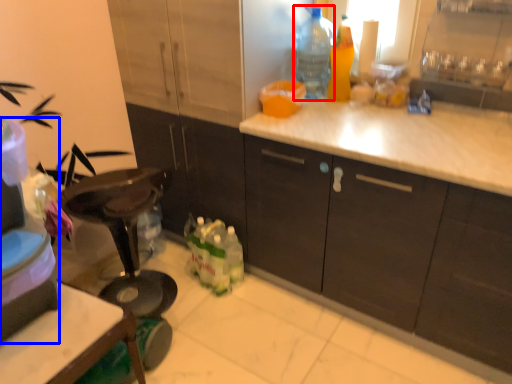
Question: Which point is further to the camera, bottle (highlighted by a red box) or appliance (highlighted by a blue box)?

Choices:
 (A) bottle
 (B) appliance

Answer: (A)